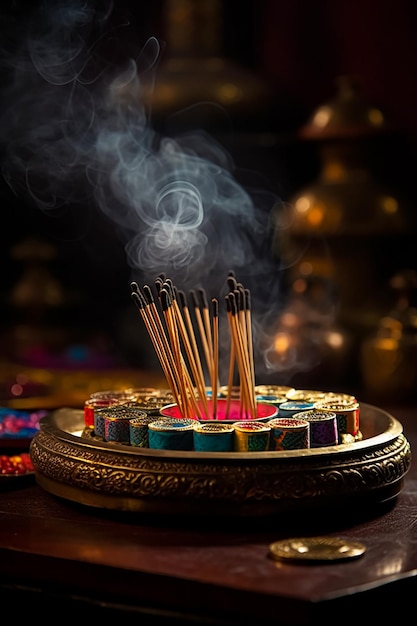
Image resolution: width=417 pixels, height=626 pixels. In order to click on edge of the table in this screenshot , I will do pyautogui.click(x=325, y=598).